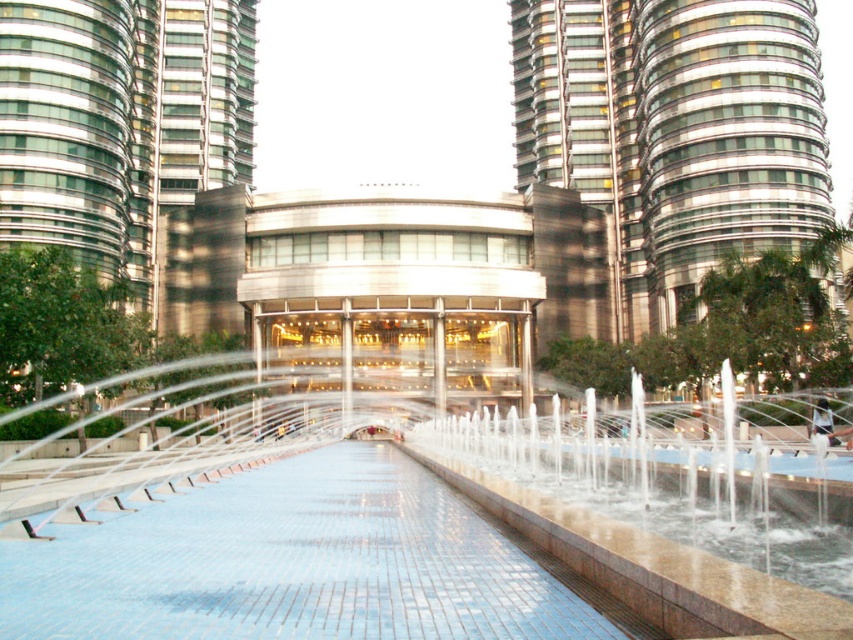
Does point (834, 628) come farther from viewer compared to point (561, 13)?

No, it is in front of (561, 13).

Is point (732, 628) positioned in front of point (647, 115)?

Yes, it is in front of point (647, 115).

The height and width of the screenshot is (640, 853). I want to click on white glossy water at center, so click(256, 520).